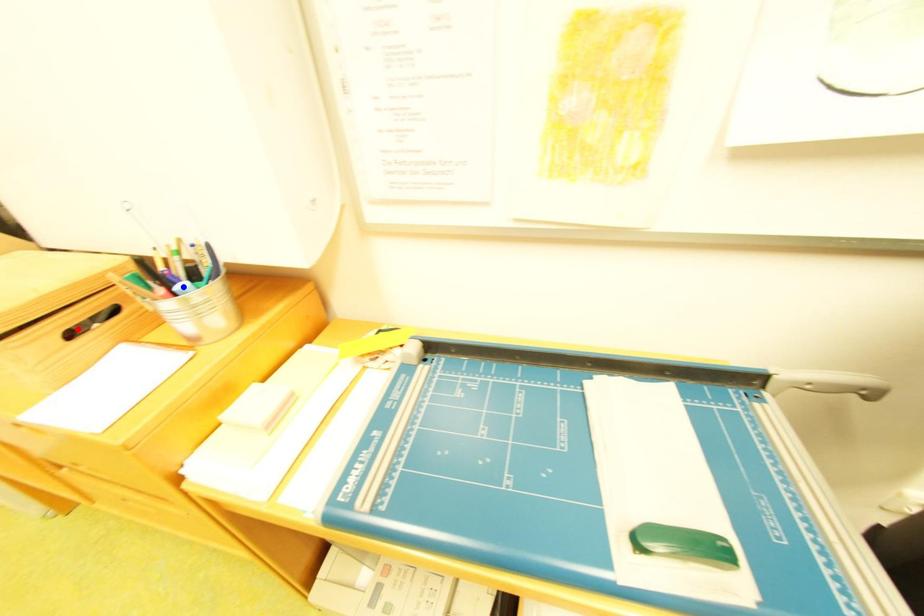
Question: Two points are marked on the image. Which point is closer to the camera?

Choices:
 (A) Blue point is closer.
 (B) Red point is closer.

Answer: (B)